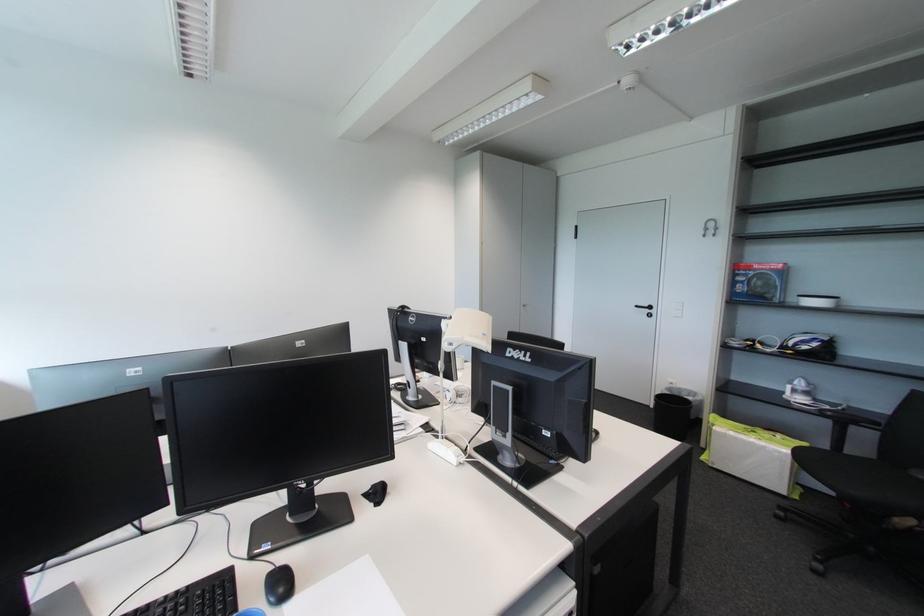
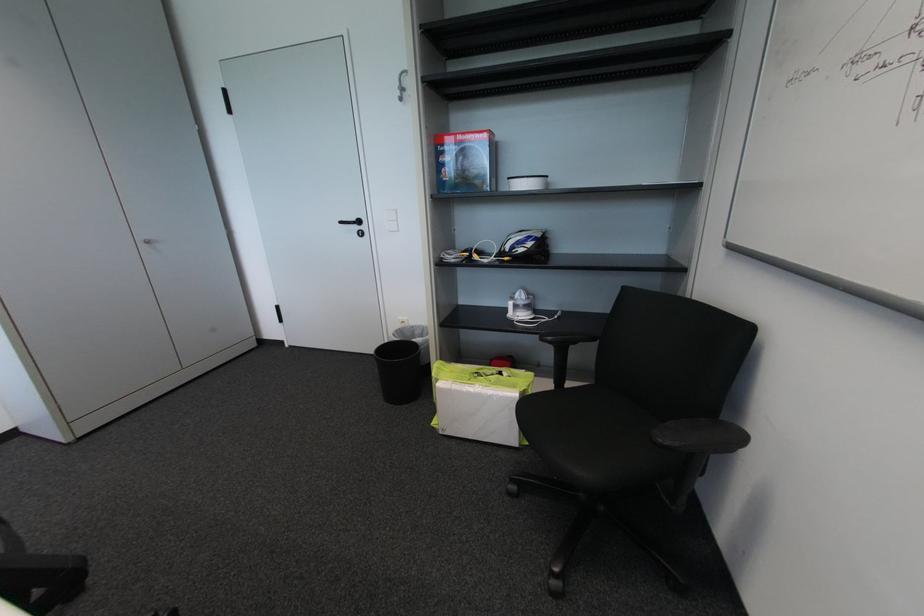
Find the pixel in the second image that matches the point at 667,400 in the first image.

(392, 351)